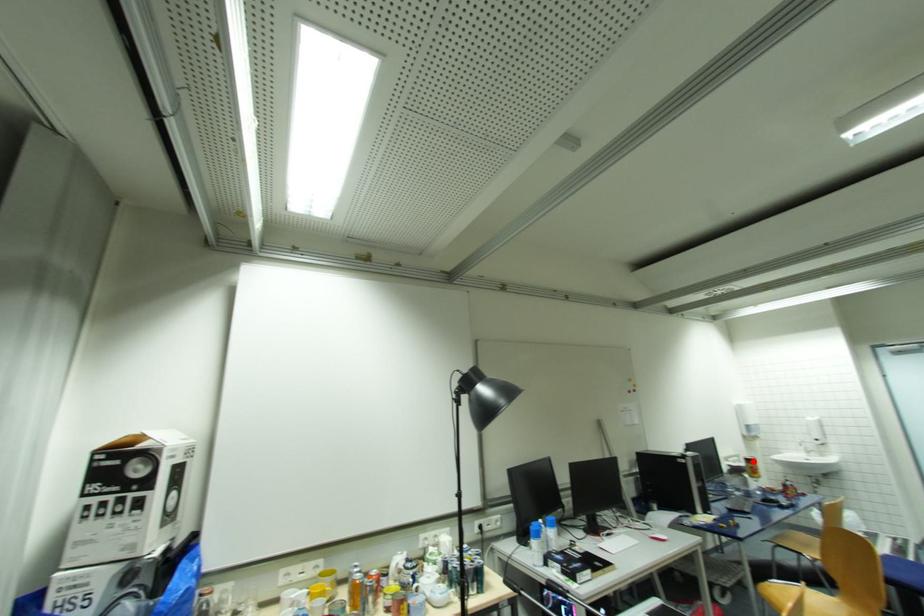
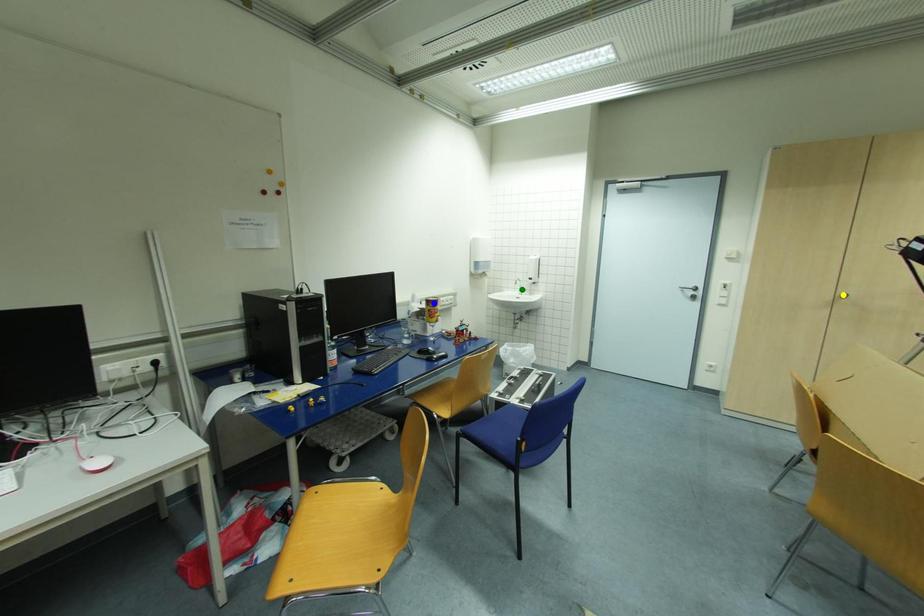
Question: I am providing you with two images of the same scene from different viewpoints. A red point is marked on the first image. You are given multiple points on the second image. Which mark in image 2 goes with the point in image 1?

Choices:
 (A) blue point
 (B) green point
 (C) yellow point

Answer: (A)